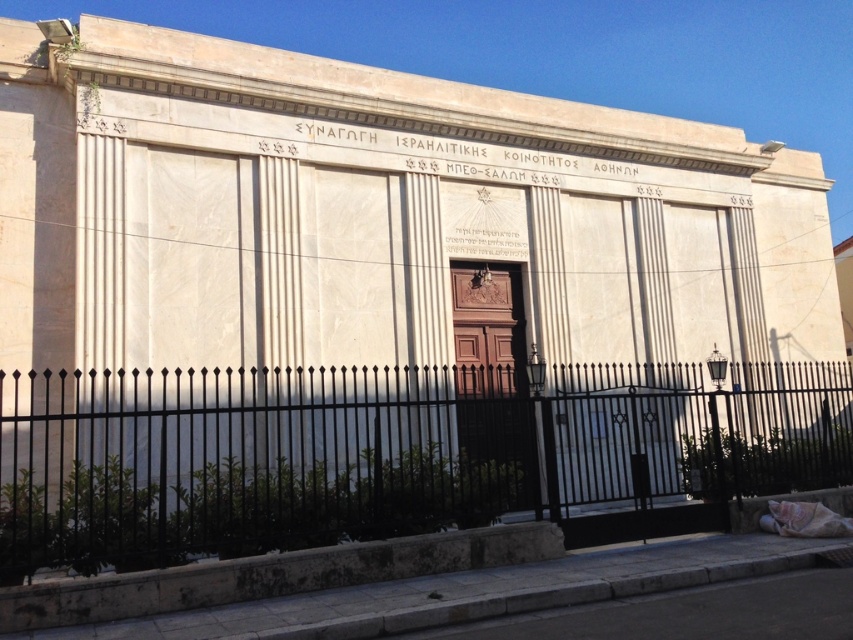
You are standing in front of the building and want to enter through the entrance. Where is the black wrought iron fence at lower center located relative to the entrance?

The black wrought iron fence at lower center is located at point (x=387, y=452), which is near the entrance area.

You are standing in front of the building and want to walk towards the entrance. Which object, the black wrought iron fence at lower center or the gray concrete curb at lower center, should you avoid stepping on?

The gray concrete curb at lower center is the object you should avoid stepping on because the black wrought iron fence at lower center is to the right of it, meaning the curb is likely in the path towards the entrance.

You are a delivery person trying to unload a package that requires placing it on a surface at least 1 meter high. You see the black wrought iron fence at lower center and the gray concrete curb at lower center. Which surface can you use?

The black wrought iron fence at lower center has a greater height compared to the gray concrete curb at lower center, so you can use the black wrought iron fence at lower center since it meets the required height of at least 1 meter.